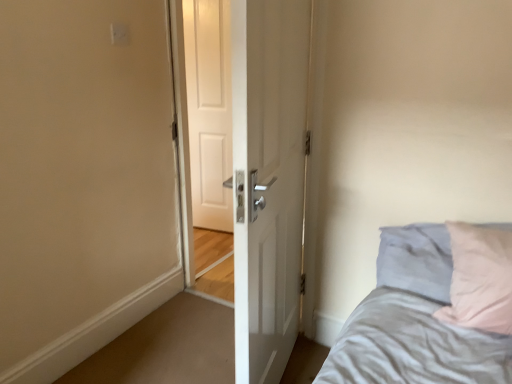
Where is `vacant space to the left of white glossy door at center`? Image resolution: width=512 pixels, height=384 pixels. vacant space to the left of white glossy door at center is located at coordinates (175, 357).